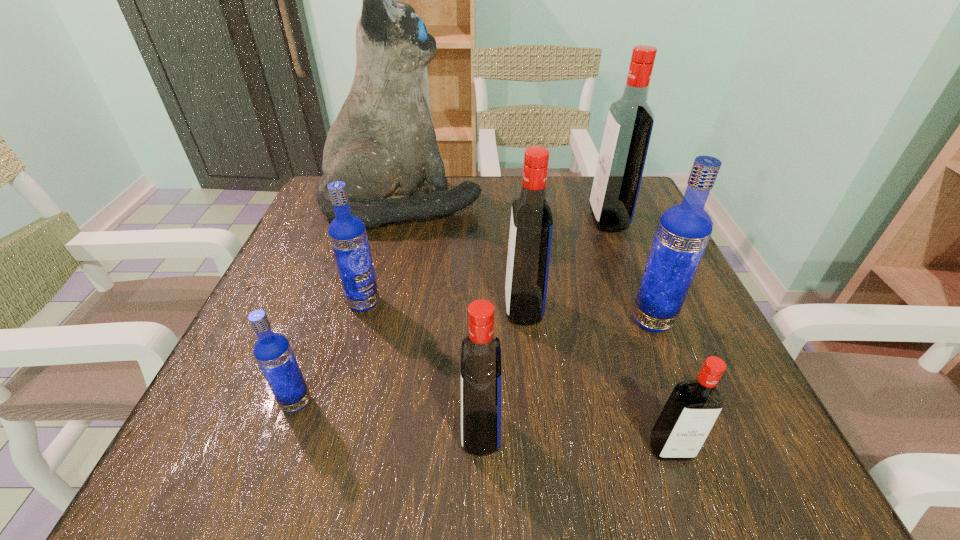
Where is `vacant space located 0.090m on the front and back of the fourth vodka from right to left`? The image size is (960, 540). vacant space located 0.090m on the front and back of the fourth vodka from right to left is located at coordinates (455, 308).

Locate an element on the screen. This screenshot has height=540, width=960. free spot located on the back of the second blue vodka from right to left is located at coordinates (374, 265).

The height and width of the screenshot is (540, 960). What are the coordinates of `vacant space located on the front and back of the leftmost red vodka` in the screenshot? It's located at (331, 433).

The height and width of the screenshot is (540, 960). I want to click on free point located on the front and back of the leftmost red vodka, so click(x=215, y=433).

I want to click on vacant point located 0.160m on the front and back of the leftmost red vodka, so click(x=346, y=433).

This screenshot has width=960, height=540. I want to click on blank space located 0.360m on the right of the smallest blue vodka, so click(x=558, y=402).

I want to click on cat that is at the far edge, so click(x=383, y=145).

Image resolution: width=960 pixels, height=540 pixels. Identify the location of vodka positioned at the far edge. (630, 120).

Find the location of a particular element. The image size is (960, 540). cat present at the left edge is located at coordinates (383, 145).

The width and height of the screenshot is (960, 540). I want to click on object present at the far left corner, so click(x=383, y=145).